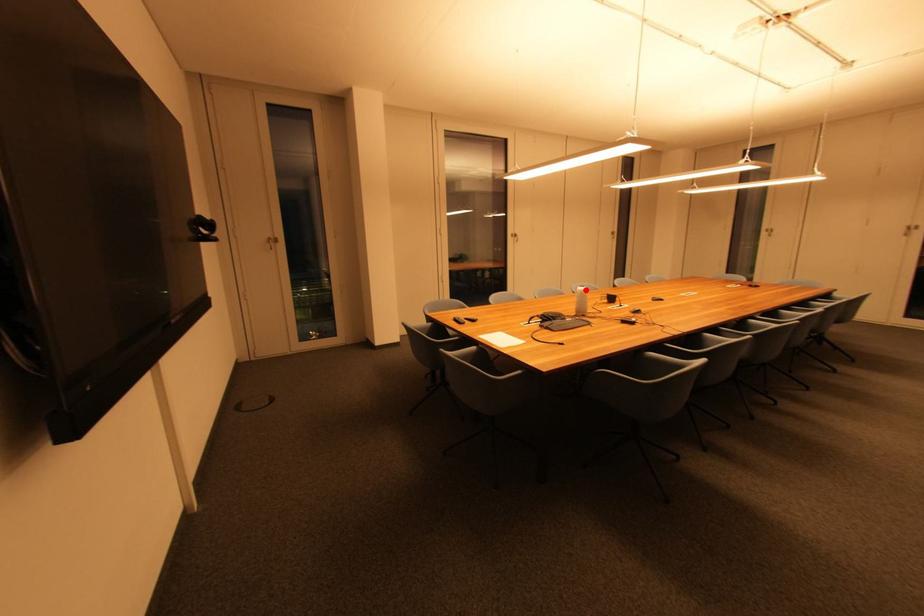
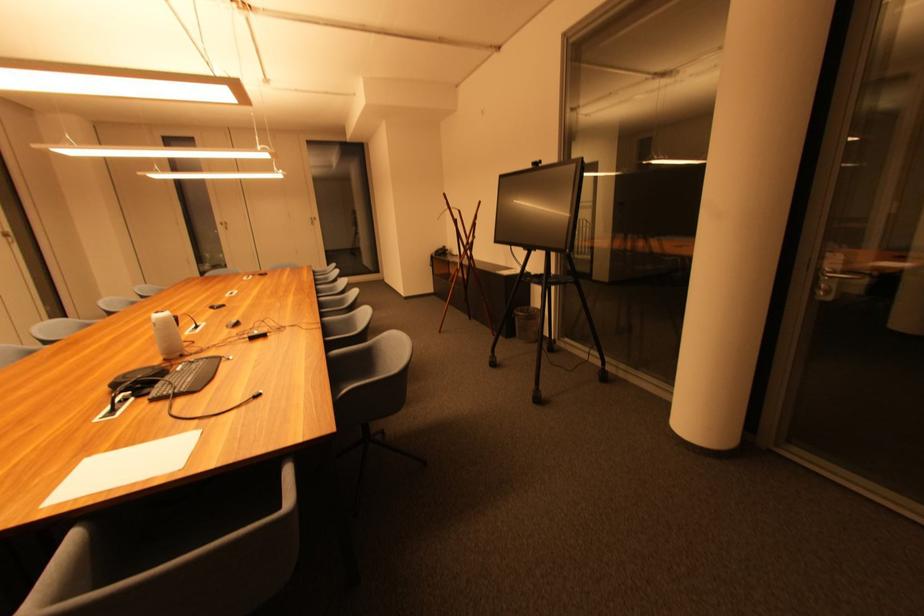
Question: I am providing you with two images of the same scene from different viewpoints. A red point is shown in image1. For the corresponding object point in image2, is it positioned nearer or farther from the camera?

Choices:
 (A) Nearer
 (B) Farther

Answer: (B)